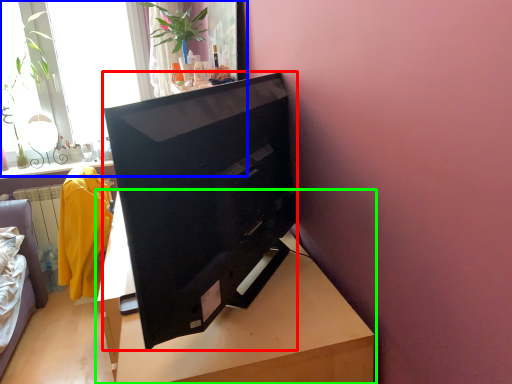
Question: Which object is the closest to the television (highlighted by a red box)? Choose among these: window (highlighted by a blue box) or table (highlighted by a green box).

Choices:
 (A) window
 (B) table

Answer: (B)